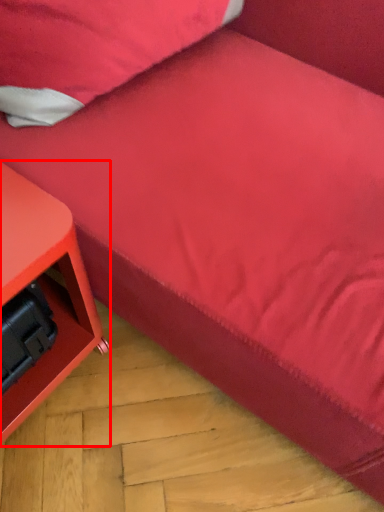
Question: From the image's perspective, what is the correct spatial positioning of furniture (annotated by the red box) in reference to pillow?

Choices:
 (A) below
 (B) above

Answer: (A)